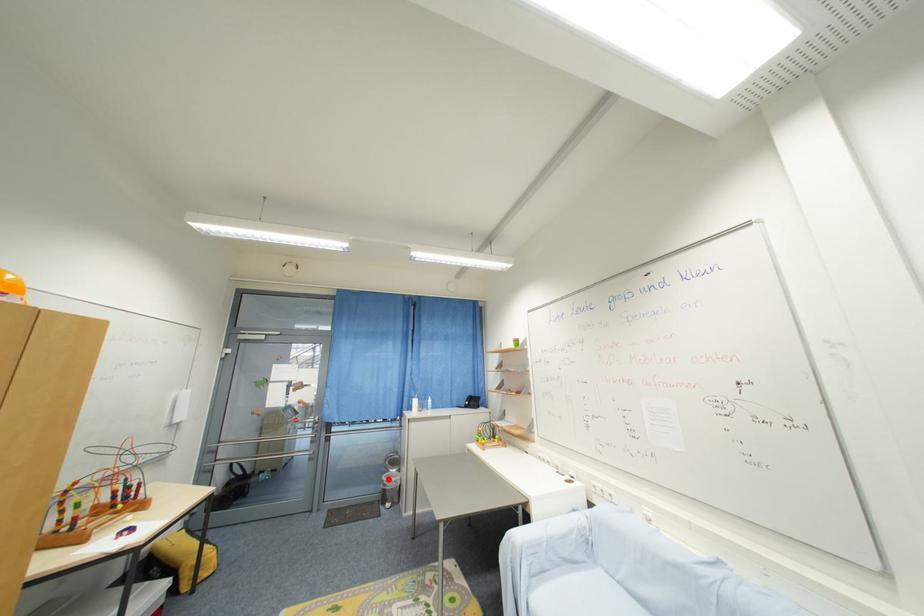
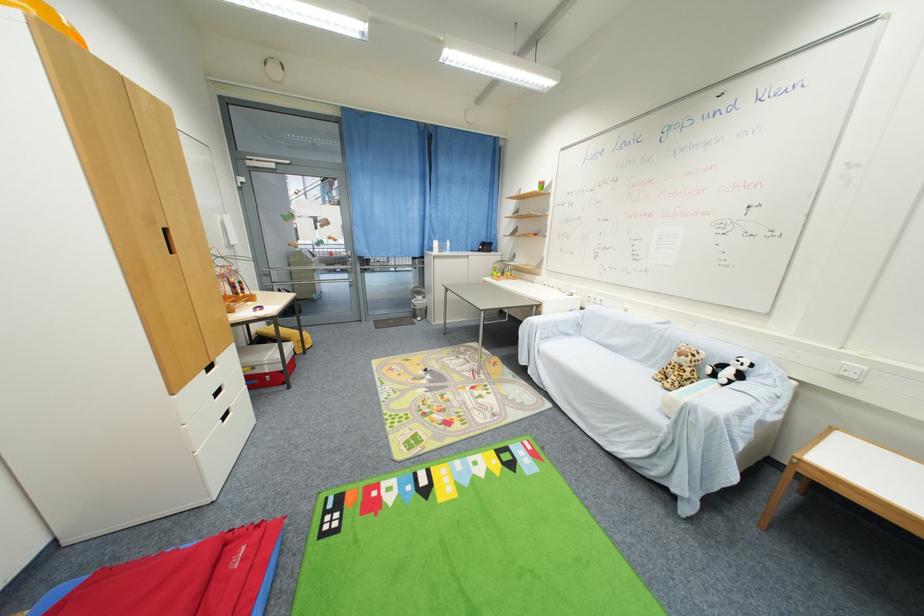
Question: I am providing you with two images of the same scene from different viewpoints. In image1, a red point is highlighted. Considering the same 3D point in image2, which of the following is correct?

Choices:
 (A) It is closer
 (B) It is farther

Answer: (A)